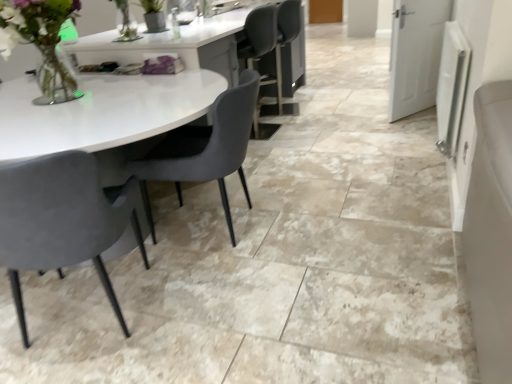
Question: From a real-world perspective, is translucent glass vase at upper left physically above matte gray chair at left, the second chair from the right?

Choices:
 (A) no
 (B) yes

Answer: (B)

Question: Is translucent glass vase at upper left in contact with matte gray chair at left, the second chair from the right?

Choices:
 (A) no
 (B) yes

Answer: (A)

Question: Would you consider translucent glass vase at upper left to be distant from matte gray chair at left, the second chair from the right?

Choices:
 (A) no
 (B) yes

Answer: (A)

Question: Is translucent glass vase at upper left further to the viewer compared to matte gray chair at left, which is counted as the 1th chair, starting from the left?

Choices:
 (A) yes
 (B) no

Answer: (A)

Question: Is translucent glass vase at upper left shorter than matte gray chair at left, the second chair from the right?

Choices:
 (A) no
 (B) yes

Answer: (B)

Question: Is translucent glass vase at upper left to the left of matte gray chair at left, which is counted as the 1th chair, starting from the left, from the viewer's perspective?

Choices:
 (A) no
 (B) yes

Answer: (B)

Question: Is velvet grey chair at center, which is the 1th chair from right to left, facing towards translucent glass vase at upper left?

Choices:
 (A) no
 (B) yes

Answer: (B)

Question: Does velvet grey chair at center, the 2th chair in the left-to-right sequence, have a greater height compared to translucent glass vase at upper left?

Choices:
 (A) yes
 (B) no

Answer: (A)

Question: From a real-world perspective, is velvet grey chair at center, which is the 1th chair from right to left, located beneath translucent glass vase at upper left?

Choices:
 (A) no
 (B) yes

Answer: (B)

Question: From the image's perspective, does velvet grey chair at center, which is the 1th chair from right to left, appear lower than translucent glass vase at upper left?

Choices:
 (A) yes
 (B) no

Answer: (A)

Question: Is velvet grey chair at center, the 2th chair in the left-to-right sequence, far from translucent glass vase at upper left?

Choices:
 (A) yes
 (B) no

Answer: (B)

Question: Does velvet grey chair at center, which is the 1th chair from right to left, have a lesser width compared to translucent glass vase at upper left?

Choices:
 (A) no
 (B) yes

Answer: (A)

Question: Is matte gray chair at left, which is counted as the 1th chair, starting from the left, facing towards translucent glass vase at upper left?

Choices:
 (A) yes
 (B) no

Answer: (A)